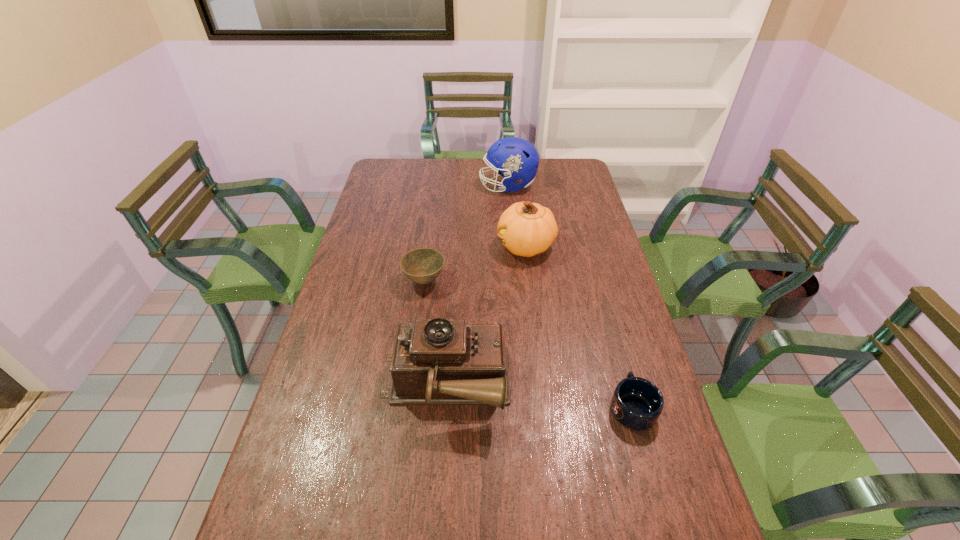
You are a GUI agent. You are given a task and a screenshot of the screen. Output one action in this format:
    pyautogui.click(x=<x>, y=<y>)
    Task: Click on the vacant point located between the bowl and the rightmost object
    The height and width of the screenshot is (540, 960).
    Given the screenshot: What is the action you would take?
    click(x=528, y=344)

I want to click on vacant region between the third farthest object and the shortest object, so [x=528, y=344].

Identify the location of the second closest object to the phonograph_record. (637, 403).

This screenshot has width=960, height=540. I want to click on the closest object relative to the phonograph_record, so click(x=422, y=265).

The height and width of the screenshot is (540, 960). Identify the location of free space that satisfies the following two spatial constraints: 1. on the face guard of the football helmet; 2. with the handle on the side of the shortest object. (527, 407).

This screenshot has width=960, height=540. Find the location of `free space that satisfies the following two spatial constraints: 1. with the handle on the side of the shortest object; 2. on the face guard of the farthest object`. free space that satisfies the following two spatial constraints: 1. with the handle on the side of the shortest object; 2. on the face guard of the farthest object is located at coordinates (570, 186).

Locate an element on the screen. vacant area in the image that satisfies the following two spatial constraints: 1. with the handle on the side of the mug; 2. on the front face of the second farthest object is located at coordinates (588, 246).

At what (x,y) coordinates should I click in order to perform the action: click on vacant point that satisfies the following two spatial constraints: 1. on the horn of the phonograph_record; 2. with the handle on the side of the rightmost object. Please return your answer as a coordinate pair (x, y). Image resolution: width=960 pixels, height=540 pixels. Looking at the image, I should click on (444, 407).

Locate an element on the screen. This screenshot has width=960, height=540. vacant position in the image that satisfies the following two spatial constraints: 1. on the face guard of the football helmet; 2. with the handle on the side of the mug is located at coordinates (527, 407).

Find the location of `free space that satisfies the following two spatial constraints: 1. with the handle on the side of the shortest object; 2. on the horn of the phonograph_record`. free space that satisfies the following two spatial constraints: 1. with the handle on the side of the shortest object; 2. on the horn of the phonograph_record is located at coordinates (627, 386).